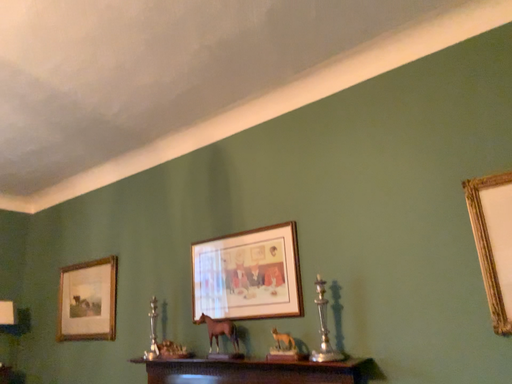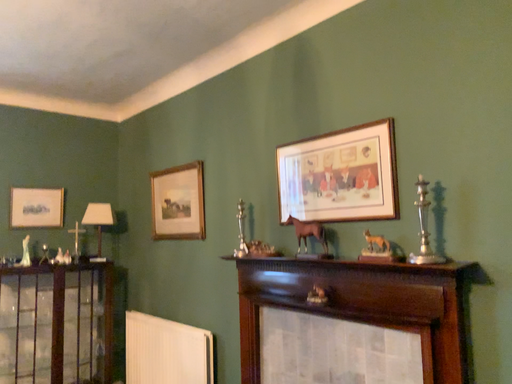
Question: How did the camera likely rotate when shooting the video?

Choices:
 (A) rotated downward
 (B) rotated upward

Answer: (A)